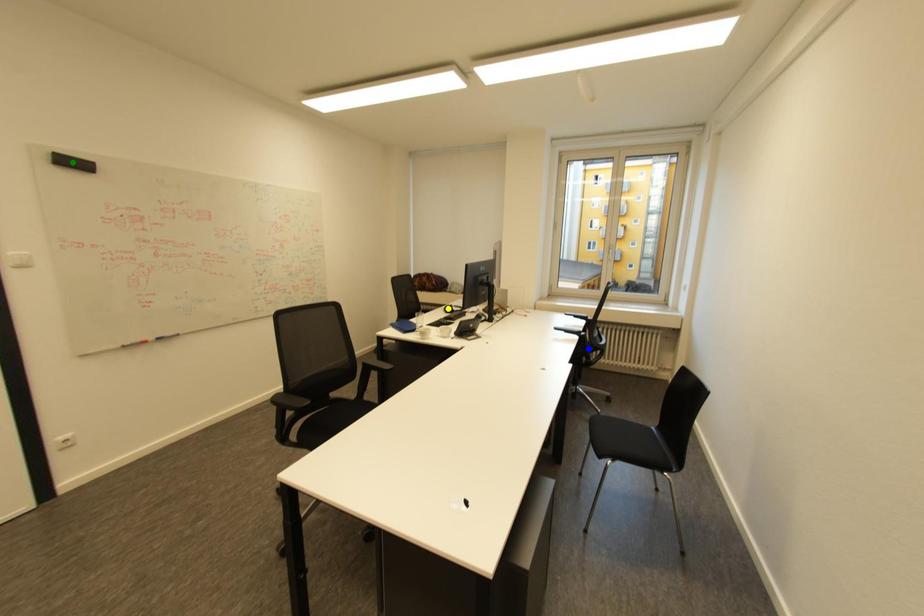
In the scene shown: Order these from nearest to farthest:
1. yellow point
2. blue point
3. green point

green point < blue point < yellow point